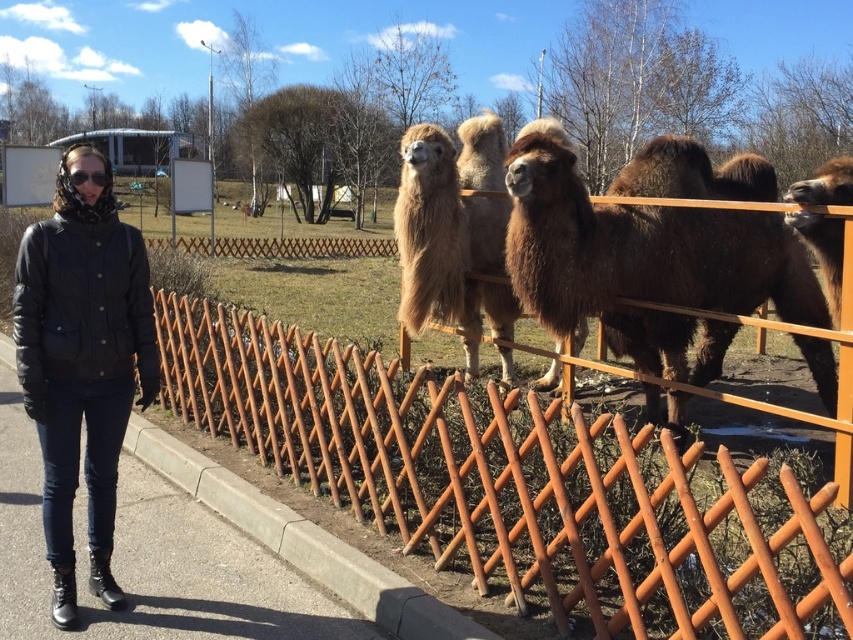
You are a photographer trying to capture the brown fuzzy camel at right through the rusty wood fence at center. Since the fence is between you and the camel, will the camel appear smaller in your photo compared to if the fence weren

The rusty wood fence at center is closer to the viewer than brown fuzzy camel at right, so the camel will appear smaller in the photo because it is farther away from the camera.

You are a photographer trying to capture both the brown fuzzy camel at right and the clear plastic goggles at upper left in the same frame. Which object should you focus on first to ensure both are in focus, considering their sizes?

The brown fuzzy camel at right is much taller than the clear plastic goggles at upper left, so you should focus on the taller brown fuzzy camel at right first to ensure both are in focus.

You are a photographer trying to capture a clear photo of the brown fuzzy camel at right. However, the rusty wood fence at center is blocking your view. Can you move to the left or right to avoid the fence while still keeping the camel in frame?

The rusty wood fence at center is positioned under the brown fuzzy camel at right, so moving to the left or right might still keep the camel in frame while avoiding the fence. However, since the fence is directly under the camel, moving slightly to the side could allow you to capture the camel without the fence obstructing the view.